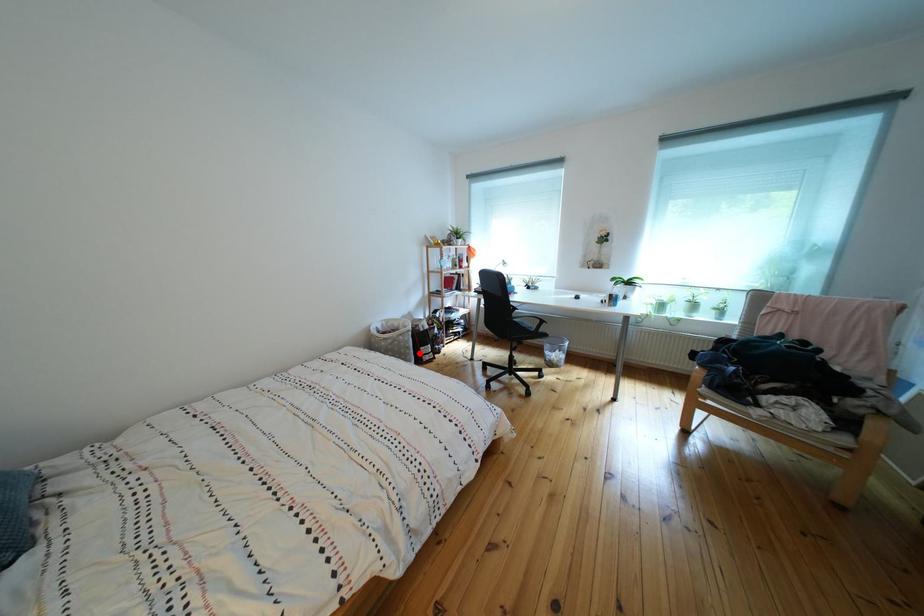
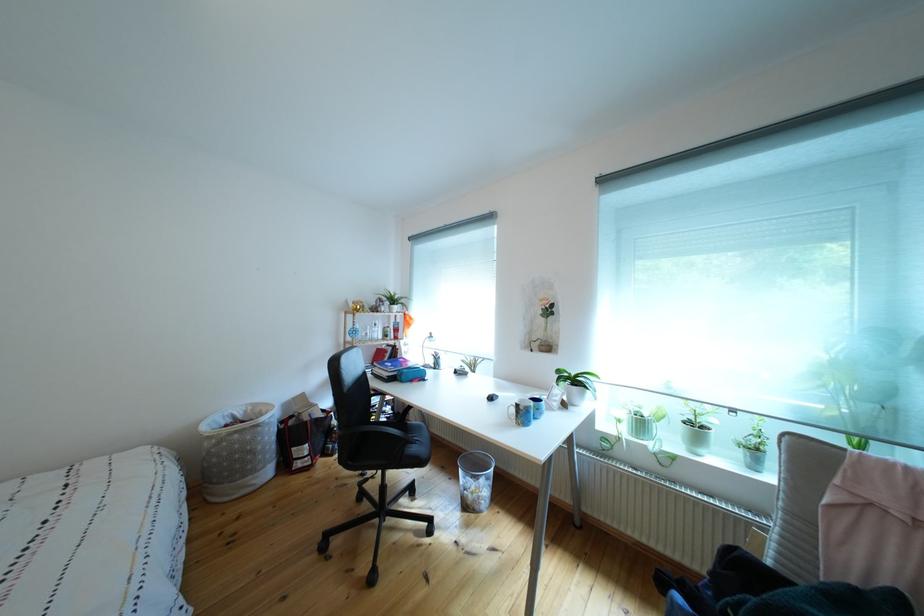
Question: I am providing you with two images of the same scene from different viewpoints. Image1 has a red point marked. In image2, the corresponding 3D location appears at what relative position? Reply with the corresponding letter.

Choices:
 (A) Closer
 (B) Farther

Answer: (B)